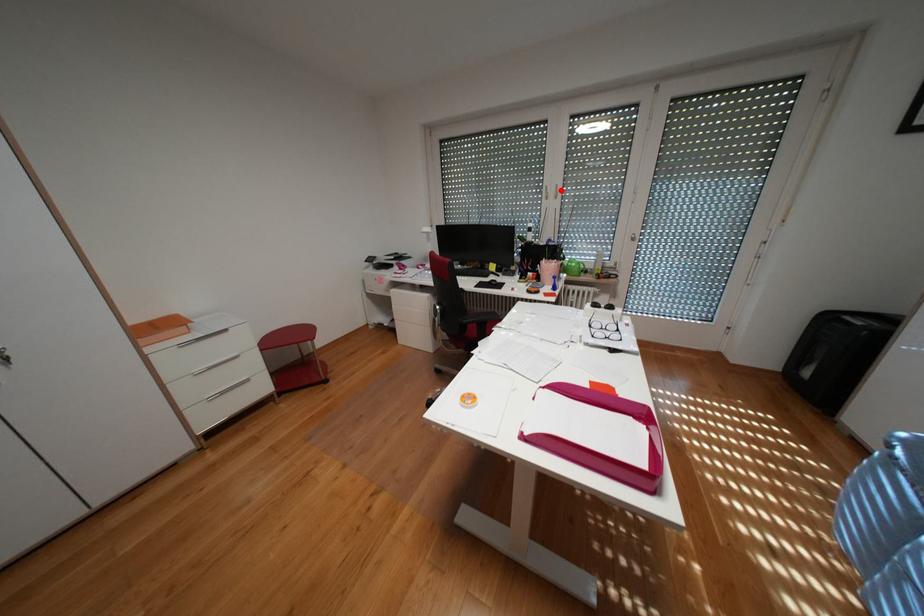
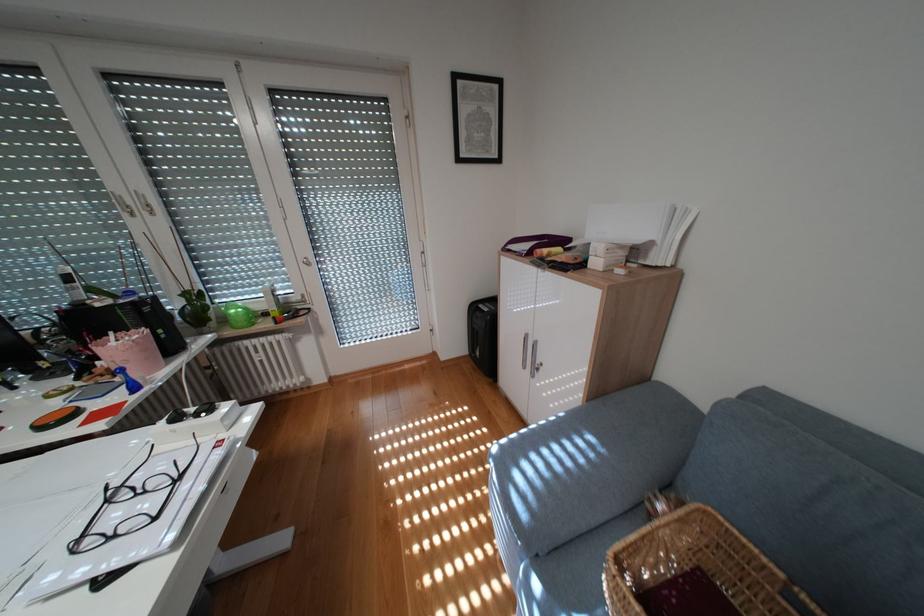
Question: A red point is marked in image1. In image2, is the corresponding 3D point closer to the camera or farther? Reply with the corresponding letter.

Choices:
 (A) The corresponding 3D point is closer.
 (B) The corresponding 3D point is farther.

Answer: (B)